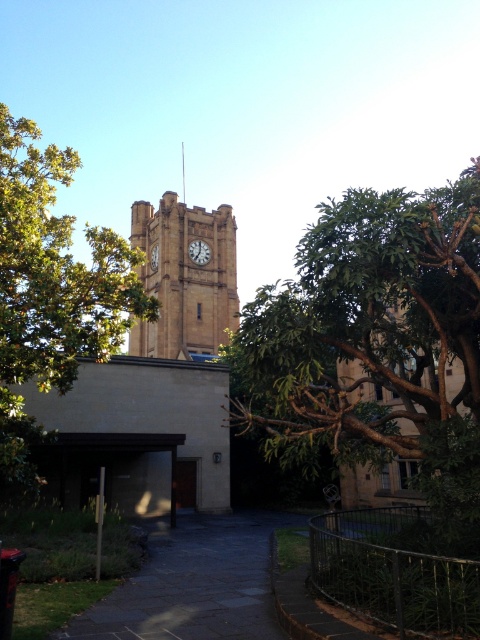
Question: Can you confirm if green leafy tree at left is thinner than matte stone clock at center?

Choices:
 (A) no
 (B) yes

Answer: (A)

Question: Does brown stone clock tower at center have a lesser width compared to matte brown clock at center?

Choices:
 (A) yes
 (B) no

Answer: (B)

Question: Which object appears closest to the camera in this image?

Choices:
 (A) matte stone clock at center
 (B) brown stone clock tower at center
 (C) green leafy tree at left

Answer: (C)

Question: Which of the following is the closest to the observer?

Choices:
 (A) (442, 528)
 (B) (197, 264)
 (C) (51, 147)
 (D) (145, 225)

Answer: (A)

Question: Which is farther from the green leafy tree at left?

Choices:
 (A) green leafy tree at center
 (B) matte brown clock at center
 (C) brown stone clock tower at center
 (D) matte stone clock at center

Answer: (D)

Question: Does green leafy tree at left come in front of brown stone clock tower at center?

Choices:
 (A) no
 (B) yes

Answer: (B)